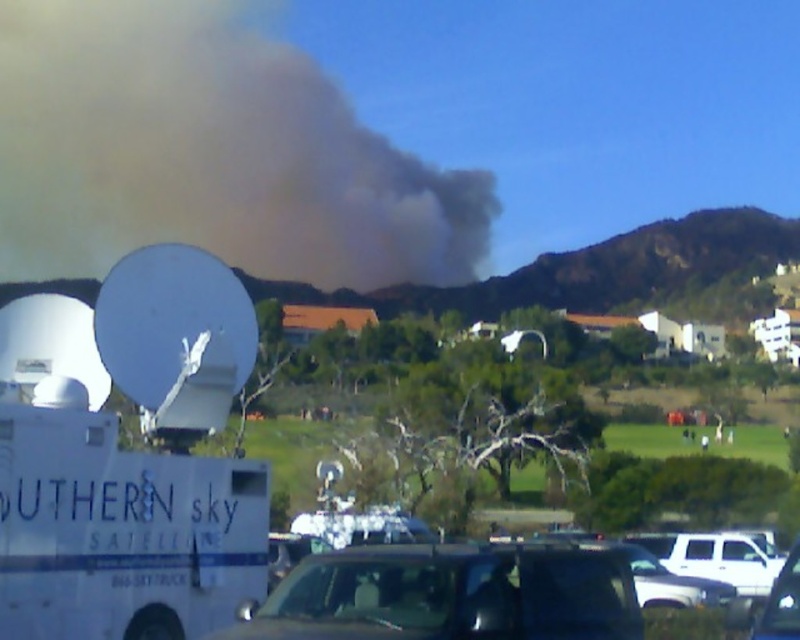
Question: Is gray/dense smoke at upper center positioned at the back of metallic silver car at center?

Choices:
 (A) no
 (B) yes

Answer: (B)

Question: Can you confirm if gray/dense smoke at upper center is positioned to the right of metallic silver car at center?

Choices:
 (A) no
 (B) yes

Answer: (A)

Question: Which of the following is the farthest from the observer?

Choices:
 (A) white matte suv at lower right
 (B) metallic silver car at center
 (C) black glossy car at center
 (D) gray/dense smoke at upper center

Answer: (D)

Question: Which point is farther to the camera?

Choices:
 (A) (786, 596)
 (B) (152, 68)
 (C) (678, 573)

Answer: (B)

Question: Does gray/dense smoke at upper center appear over white matte suv at lower right?

Choices:
 (A) no
 (B) yes

Answer: (B)

Question: Which point is farther from the camera taking this photo?

Choices:
 (A) (796, 544)
 (B) (649, 538)

Answer: (B)